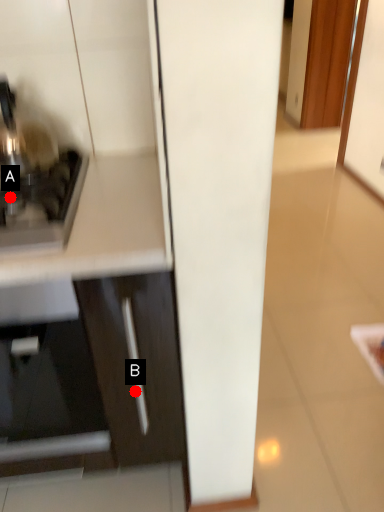
Question: Two points are circled on the image, labeled by A and B beside each circle. Which of the following is the farthest from the observer?

Choices:
 (A) A is further
 (B) B is further

Answer: (B)